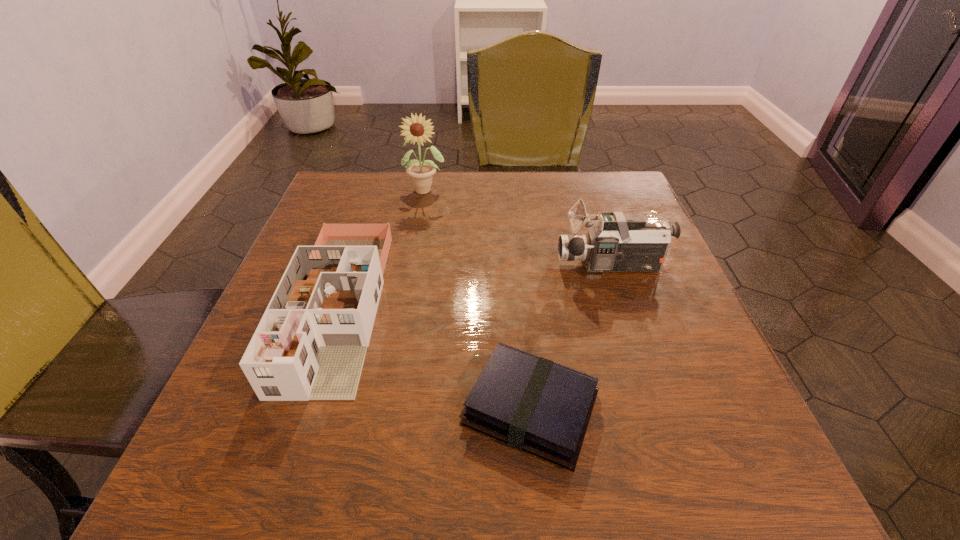
Locate an element on the screen. The height and width of the screenshot is (540, 960). the tallest object is located at coordinates (421, 173).

You are a GUI agent. You are given a task and a screenshot of the screen. Output one action in this format:
    pyautogui.click(x=<x>, y=<y>)
    Task: Click on the sunflower
    
    Given the screenshot: What is the action you would take?
    pyautogui.click(x=421, y=173)

Where is `the third shortest object`? This screenshot has height=540, width=960. the third shortest object is located at coordinates (618, 242).

This screenshot has height=540, width=960. In order to click on the third tallest object in this screenshot , I will do `click(311, 342)`.

Find the location of `book`. book is located at coordinates (533, 404).

Find the location of a particular element. The height and width of the screenshot is (540, 960). vacant space located on the front-facing side of the tallest object is located at coordinates (406, 307).

I want to click on blank space located 0.300m on the front-facing side of the second tallest object, so click(413, 266).

At what (x,y) coordinates should I click in order to perform the action: click on free spot located 0.070m on the front-facing side of the second tallest object. Please return your answer as a coordinate pair (x, y). The image size is (960, 540). Looking at the image, I should click on (524, 266).

Find the location of a particular element. The image size is (960, 540). free region located on the front-facing side of the second tallest object is located at coordinates (422, 266).

Identify the location of free spot located 0.110m at the entrance of the dollhouse. The image size is (960, 540). (284, 472).